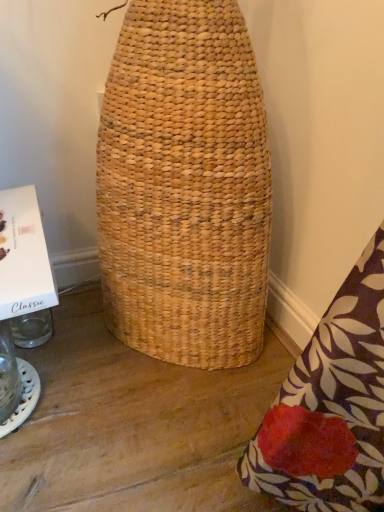
Question: Considering the relative positions of transparent glass jar at lower left and white cardboard box at left in the image provided, is transparent glass jar at lower left in front of white cardboard box at left?

Choices:
 (A) yes
 (B) no

Answer: (B)

Question: Considering the relative sizes of transparent glass jar at lower left and white cardboard box at left in the image provided, is transparent glass jar at lower left bigger than white cardboard box at left?

Choices:
 (A) yes
 (B) no

Answer: (A)

Question: Can you see transparent glass jar at lower left touching white cardboard box at left?

Choices:
 (A) no
 (B) yes

Answer: (A)

Question: Can you confirm if transparent glass jar at lower left is shorter than white cardboard box at left?

Choices:
 (A) yes
 (B) no

Answer: (B)

Question: Is transparent glass jar at lower left looking in the opposite direction of white cardboard box at left?

Choices:
 (A) no
 (B) yes

Answer: (A)

Question: Is transparent glass jar at lower left at the left side of white cardboard box at left?

Choices:
 (A) no
 (B) yes

Answer: (B)

Question: Are white cardboard box at left and transparent glass jar at lower left beside each other?

Choices:
 (A) no
 (B) yes

Answer: (A)

Question: Could you tell me if white cardboard box at left is turned towards transparent glass jar at lower left?

Choices:
 (A) no
 (B) yes

Answer: (A)

Question: Considering the relative positions of white cardboard box at left and transparent glass jar at lower left in the image provided, is white cardboard box at left behind transparent glass jar at lower left?

Choices:
 (A) yes
 (B) no

Answer: (B)

Question: Is white cardboard box at left not within transparent glass jar at lower left?

Choices:
 (A) no
 (B) yes

Answer: (B)

Question: From a real-world perspective, is white cardboard box at left on top of transparent glass jar at lower left?

Choices:
 (A) no
 (B) yes

Answer: (B)

Question: Can you confirm if white cardboard box at left is positioned to the right of transparent glass jar at lower left?

Choices:
 (A) yes
 (B) no

Answer: (A)

Question: Based on their sizes in the image, would you say white cardboard box at left is bigger or smaller than transparent glass jar at lower left?

Choices:
 (A) small
 (B) big

Answer: (A)